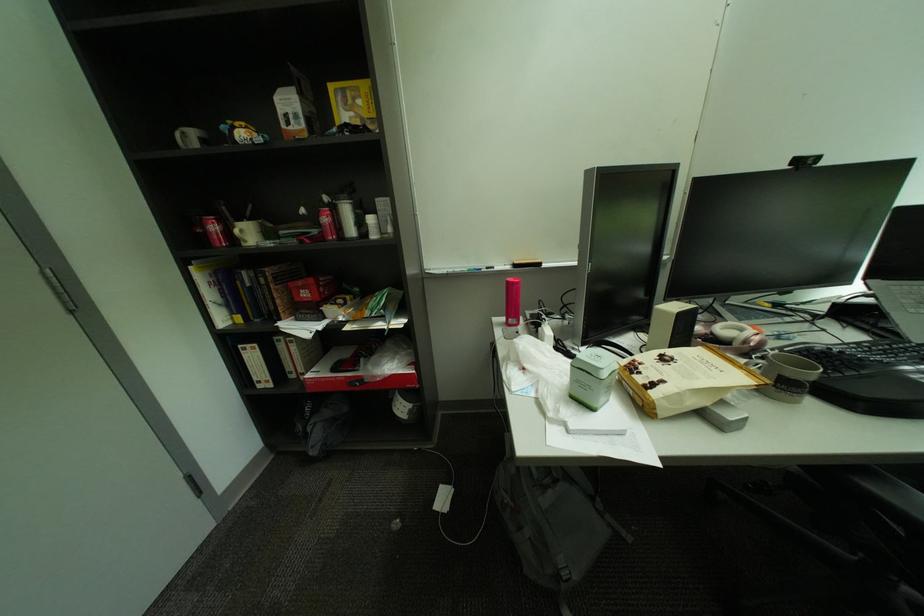
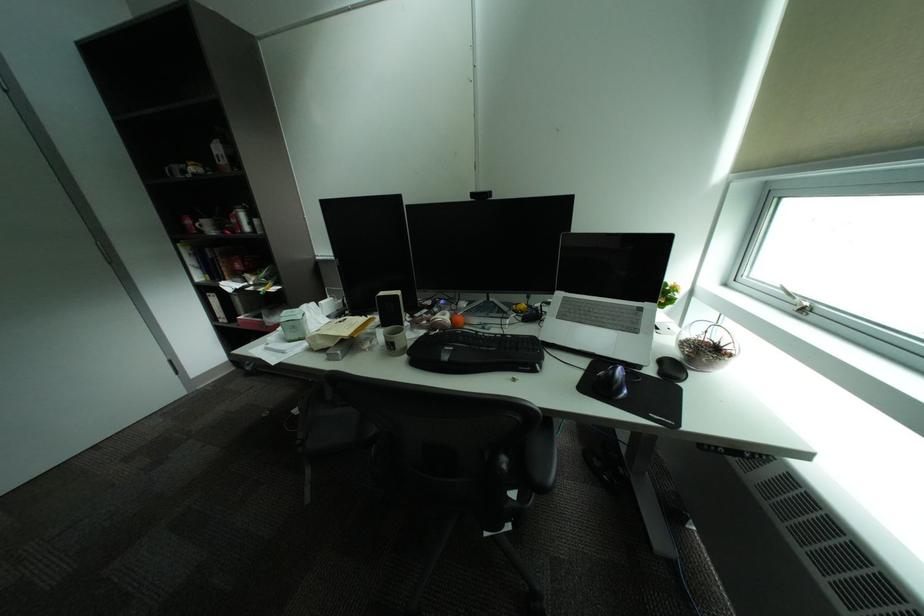
Locate, in the second image, the point that corresponds to point 869,345 in the first image.

(516, 336)